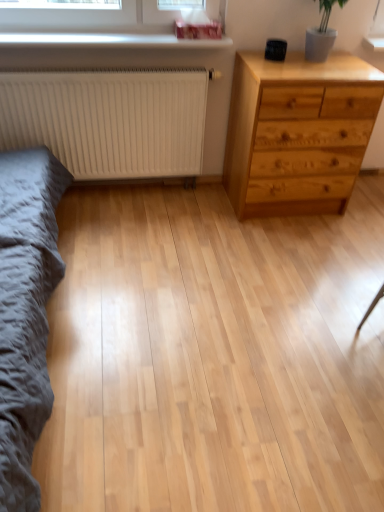
The image size is (384, 512). I want to click on unoccupied region to the right of natural wood chest of drawers at right, so click(x=364, y=208).